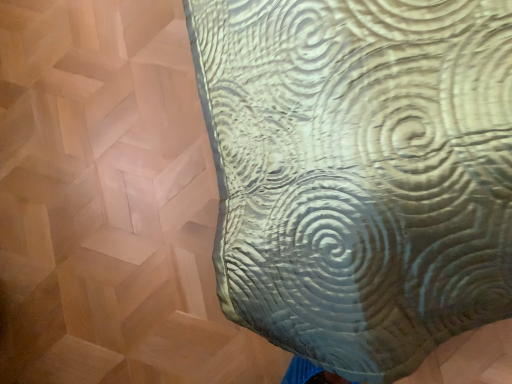
Where is `free space above metallic quilt at upper right (from a real-world perspective)`? free space above metallic quilt at upper right (from a real-world perspective) is located at coordinates (119, 203).